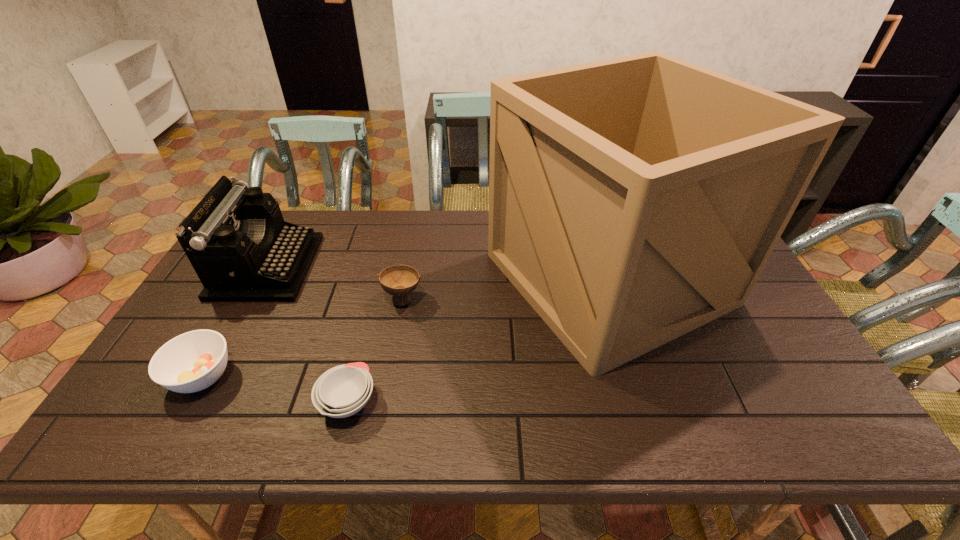
At what (x,y) coordinates should I click in order to perform the action: click on object located at the far right corner. Please return your answer as a coordinate pair (x, y). Looking at the image, I should click on (632, 200).

In the image, there is a desktop. Where is `free region at the far edge`? The image size is (960, 540). free region at the far edge is located at coordinates (408, 236).

This screenshot has height=540, width=960. What are the coordinates of `vacant space at the near edge of the desktop` in the screenshot? It's located at (272, 440).

The height and width of the screenshot is (540, 960). What are the coordinates of `vacant area at the right edge of the desktop` in the screenshot? It's located at (756, 345).

In the image, there is a desktop. Where is `vacant space at the near left corner`? The height and width of the screenshot is (540, 960). vacant space at the near left corner is located at coordinates (178, 419).

Find the location of `vacant space that is in between the second tallest soup bowl and the shortest soup bowl`. vacant space that is in between the second tallest soup bowl and the shortest soup bowl is located at coordinates (275, 389).

Find the location of `unoccupied position between the tallest object and the second tallest soup bowl`. unoccupied position between the tallest object and the second tallest soup bowl is located at coordinates (405, 327).

Find the location of `free area in between the typewriter and the tallest object`. free area in between the typewriter and the tallest object is located at coordinates (438, 272).

Locate an element on the screen. unoccupied position between the tallest soup bowl and the fourth tallest object is located at coordinates (302, 338).

What are the coordinates of `free spot between the tallest soup bowl and the tallest object` in the screenshot? It's located at (506, 288).